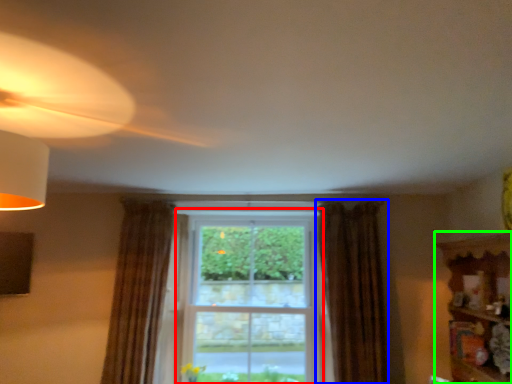
Question: Which object is positioned closest to bay window (highlighted by a red box)? Select from curtain (highlighted by a blue box) and shelf (highlighted by a green box).

Choices:
 (A) curtain
 (B) shelf

Answer: (A)